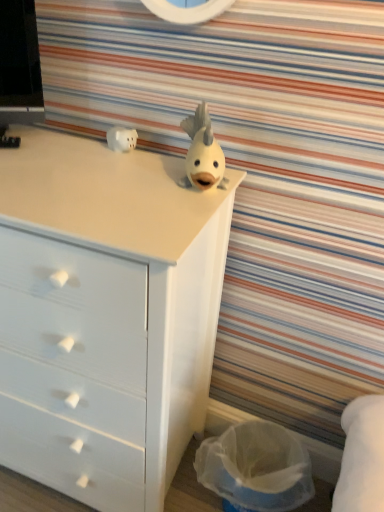
Question: Is white matte piggy bank at upper left, which is counted as the second toy, starting from the right, at the left side of translucent plastic laundry basket at lower right?

Choices:
 (A) yes
 (B) no

Answer: (A)

Question: Is translucent plastic laundry basket at lower right at the back of white matte piggy bank at upper left, the 1th toy in the left-to-right sequence?

Choices:
 (A) no
 (B) yes

Answer: (A)

Question: Is white matte piggy bank at upper left, which is counted as the second toy, starting from the right, next to translucent plastic laundry basket at lower right and touching it?

Choices:
 (A) no
 (B) yes

Answer: (A)

Question: Is white matte piggy bank at upper left, the second toy positioned from the front, bigger than translucent plastic laundry basket at lower right?

Choices:
 (A) no
 (B) yes

Answer: (A)

Question: From a real-world perspective, is white matte piggy bank at upper left, the second toy positioned from the front, physically below translucent plastic laundry basket at lower right?

Choices:
 (A) no
 (B) yes

Answer: (A)

Question: From the image's perspective, does white matte piggy bank at upper left, the second toy positioned from the front, appear higher than translucent plastic laundry basket at lower right?

Choices:
 (A) no
 (B) yes

Answer: (B)

Question: From a real-world perspective, is white matte fish at center, the second toy positioned from the back, physically below white matte chest of drawers at upper center?

Choices:
 (A) yes
 (B) no

Answer: (B)

Question: Does white matte fish at center, placed as the 1th toy when sorted from front to back, have a larger size compared to white matte chest of drawers at upper center?

Choices:
 (A) yes
 (B) no

Answer: (B)

Question: Does white matte fish at center, positioned as the second toy in left-to-right order, lie behind white matte chest of drawers at upper center?

Choices:
 (A) yes
 (B) no

Answer: (A)

Question: From the image's perspective, is white matte fish at center, the second toy positioned from the back, under white matte chest of drawers at upper center?

Choices:
 (A) yes
 (B) no

Answer: (B)

Question: Is white matte fish at center, which appears as the first toy when viewed from the right, to the left of white matte chest of drawers at upper center from the viewer's perspective?

Choices:
 (A) yes
 (B) no

Answer: (B)

Question: Considering the relative sizes of white matte fish at center, the second toy positioned from the back, and white matte chest of drawers at upper center in the image provided, is white matte fish at center, the second toy positioned from the back, wider than white matte chest of drawers at upper center?

Choices:
 (A) no
 (B) yes

Answer: (A)

Question: Is white matte chest of drawers at upper center positioned in front of white matte piggy bank at upper left, the 1th toy in the left-to-right sequence?

Choices:
 (A) no
 (B) yes

Answer: (B)